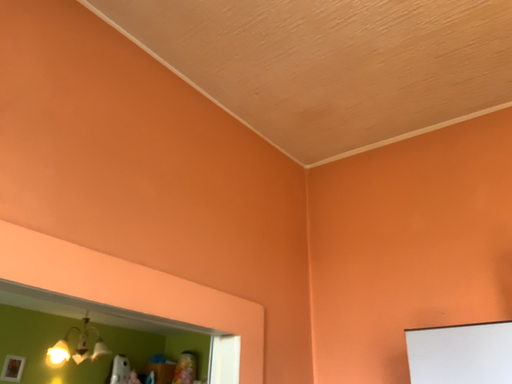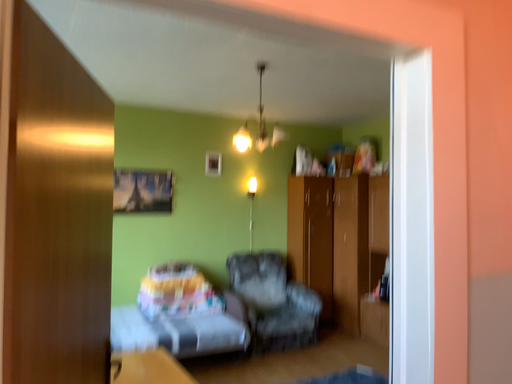
Question: Which way did the camera rotate in the video?

Choices:
 (A) rotated upward
 (B) rotated downward

Answer: (B)